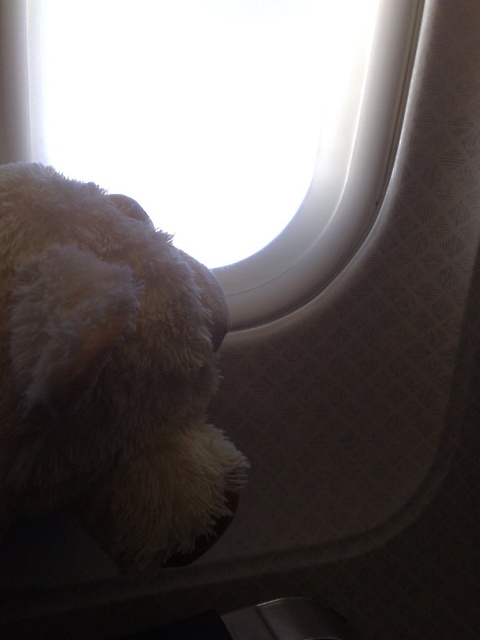
From the picture: Does white fluffy stuffed animal at left appear under white fluffy teddy bear at lower left?

Yes.

Can you confirm if white fluffy stuffed animal at left is positioned to the left of white fluffy teddy bear at lower left?

Indeed, white fluffy stuffed animal at left is positioned on the left side of white fluffy teddy bear at lower left.

Find the location of a particular element. white fluffy stuffed animal at left is located at coordinates (108, 371).